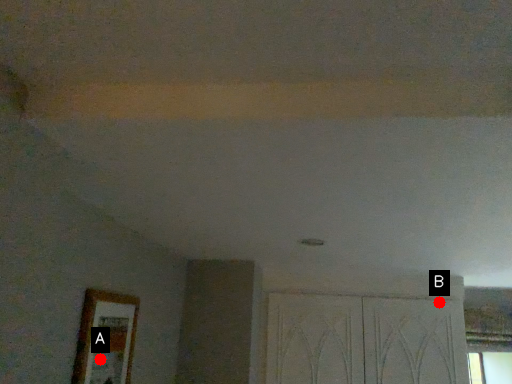
Question: Two points are circled on the image, labeled by A and B beside each circle. Which of the following is the closest to the observer?

Choices:
 (A) A is closer
 (B) B is closer

Answer: (A)